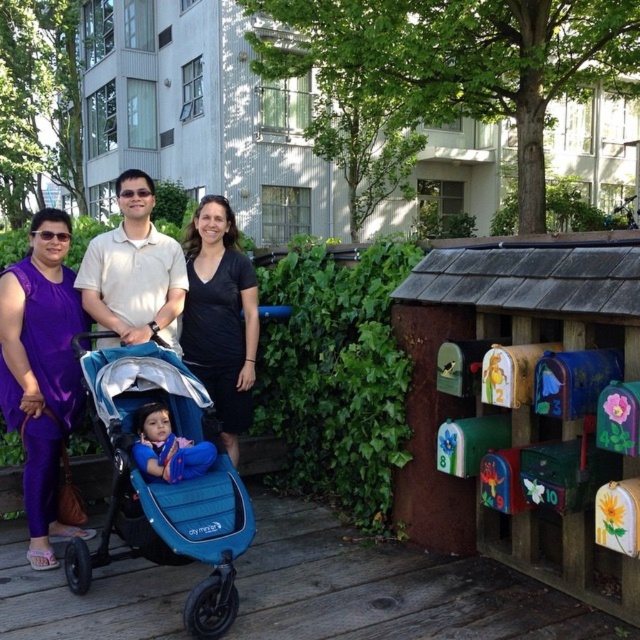
Is purple fabric dress at left positioned before matte white polo shirt at center?

That is True.

Is point (29, 474) in front of point (170, 326)?

Yes, point (29, 474) is closer to viewer.

Locate an element on the screen. purple fabric dress at left is located at coordinates (42, 372).

Looking at this image, does matte blue stroller at center have a lesser width compared to black matte dress at center?

No.

Is matte blue stroller at center smaller than black matte dress at center?

No.

Which is in front, point (109, 262) or point (230, 444)?

Point (109, 262) is in front.

Where is `matte blue stroller at center`? This screenshot has height=640, width=640. matte blue stroller at center is located at coordinates (134, 272).

Is point (253, 312) farther from camera compared to point (125, 198)?

Yes, point (253, 312) is behind point (125, 198).

Locate an element on the screen. The height and width of the screenshot is (640, 640). black matte dress at center is located at coordinates (220, 316).